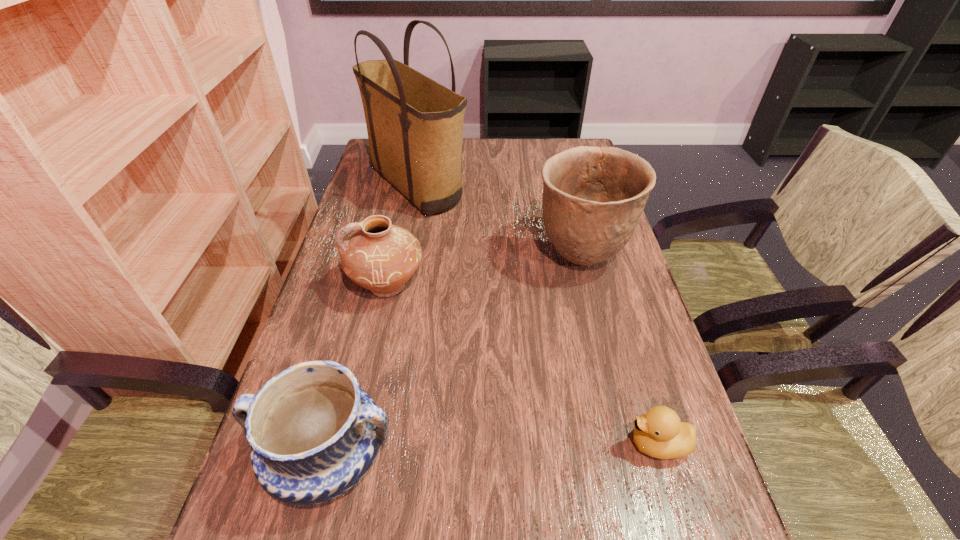
The height and width of the screenshot is (540, 960). In order to click on empty space between the shortest object and the nearest pottery in this screenshot , I will do `click(493, 451)`.

The height and width of the screenshot is (540, 960). I want to click on free space between the tote bag and the shortest object, so click(538, 316).

Find the location of a particular element. This screenshot has width=960, height=540. free spot between the shortest object and the second tallest object is located at coordinates (619, 351).

I want to click on free space that is in between the nearest pottery and the tote bag, so click(373, 322).

At what (x,y) coordinates should I click in order to perform the action: click on unoccupied area between the tote bag and the duckling. Please return your answer as a coordinate pair (x, y). Image resolution: width=960 pixels, height=540 pixels. Looking at the image, I should click on (538, 316).

Identify the location of free spot between the farthest object and the rightmost pottery. (499, 223).

Identify which object is the third closest to the nearest pottery. Please provide its 2D coordinates. Your answer should be formatted as a tuple, i.e. [(x, y)], where the tuple contains the x and y coordinates of a point satisfying the conditions above.

[(593, 197)]

Locate which object ranks second in proximity to the tallest pottery. Please provide its 2D coordinates. Your answer should be formatted as a tuple, i.e. [(x, y)], where the tuple contains the x and y coordinates of a point satisfying the conditions above.

[(382, 257)]

Locate which pottery ranks in proximity to the duckling. Please provide its 2D coordinates. Your answer should be formatted as a tuple, i.e. [(x, y)], where the tuple contains the x and y coordinates of a point satisfying the conditions above.

[(593, 197)]

Choose which pottery is the third nearest neighbor to the duckling. Please provide its 2D coordinates. Your answer should be formatted as a tuple, i.e. [(x, y)], where the tuple contains the x and y coordinates of a point satisfying the conditions above.

[(382, 257)]